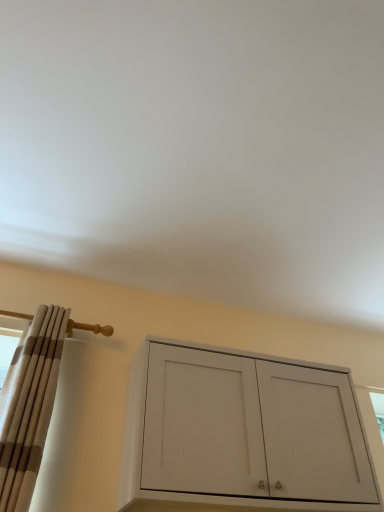
Question: Based on their sizes in the image, would you say white matte cabinet at center is bigger or smaller than beige striped curtain at left?

Choices:
 (A) big
 (B) small

Answer: (A)

Question: Considering the positions of white matte cabinet at center and beige striped curtain at left in the image, is white matte cabinet at center wider or thinner than beige striped curtain at left?

Choices:
 (A) thin
 (B) wide

Answer: (B)

Question: Is white matte cabinet at center to the left or to the right of beige striped curtain at left in the image?

Choices:
 (A) left
 (B) right

Answer: (B)

Question: In the image, is beige striped curtain at left positioned in front of or behind white matte cabinet at center?

Choices:
 (A) front
 (B) behind

Answer: (A)

Question: Does point (31, 392) appear closer or farther from the camera than point (193, 393)?

Choices:
 (A) closer
 (B) farther

Answer: (A)

Question: Is beige striped curtain at left spatially inside white matte cabinet at center, or outside of it?

Choices:
 (A) inside
 (B) outside

Answer: (B)

Question: Is beige striped curtain at left wider or thinner than white matte cabinet at center?

Choices:
 (A) wide
 (B) thin

Answer: (B)